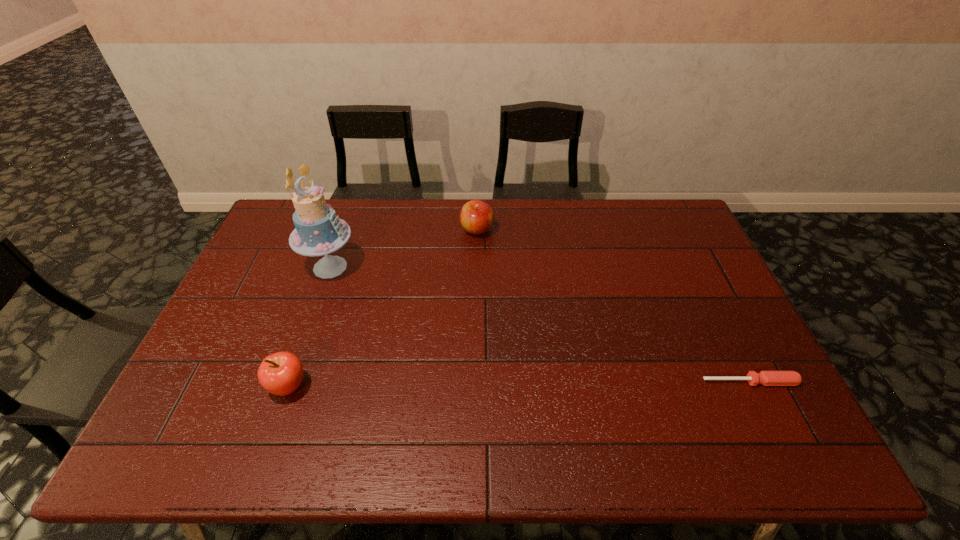
Identify the location of vacant point located between the right apple and the screwdriver. The image size is (960, 540). (613, 306).

I want to click on unoccupied position between the right apple and the screwdriver, so click(x=613, y=306).

The image size is (960, 540). I want to click on empty space that is in between the cake and the second object from right to left, so 403,248.

Where is `free space between the third nearest object and the farther apple`? This screenshot has width=960, height=540. free space between the third nearest object and the farther apple is located at coordinates (403, 248).

The image size is (960, 540). I want to click on unoccupied position between the left apple and the right apple, so pyautogui.click(x=383, y=308).

Point out which object is positioned as the second nearest to the cake. Please provide its 2D coordinates. Your answer should be formatted as a tuple, i.e. [(x, y)], where the tuple contains the x and y coordinates of a point satisfying the conditions above.

[(476, 216)]

Identify which object is located as the nearest to the cake. Please provide its 2D coordinates. Your answer should be formatted as a tuple, i.e. [(x, y)], where the tuple contains the x and y coordinates of a point satisfying the conditions above.

[(281, 373)]